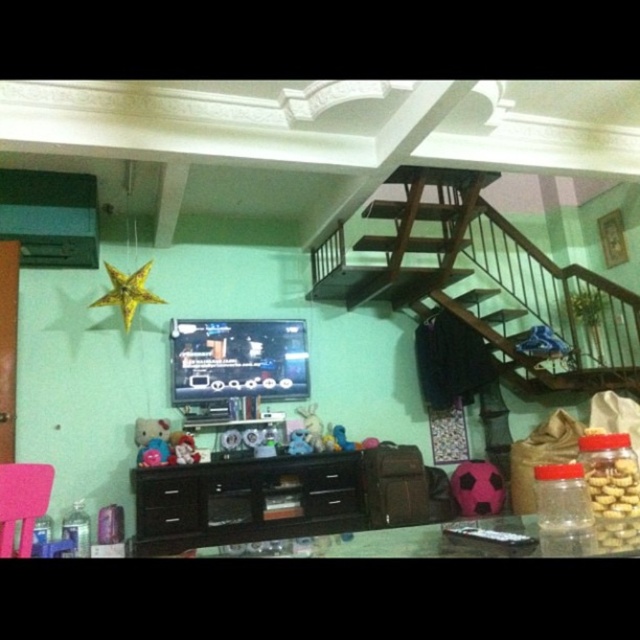
Question: Can you confirm if wooden stairs at upper center is thinner than pink fabric chair at lower left?

Choices:
 (A) yes
 (B) no

Answer: (B)

Question: Which of the following is the farthest from the observer?

Choices:
 (A) plush pink teddy bear at center
 (B) black glossy entertainment center at center
 (C) wooden stairs at upper center

Answer: (A)

Question: Among these points, which one is farthest from the camera?

Choices:
 (A) (168, 515)
 (B) (49, 488)
 (C) (193, 440)

Answer: (C)

Question: Does black glossy entertainment center at center appear over plush pink teddy bear at center?

Choices:
 (A) yes
 (B) no

Answer: (B)

Question: Can you confirm if wooden stairs at upper center is positioned to the left of black glossy entertainment center at center?

Choices:
 (A) no
 (B) yes

Answer: (A)

Question: Among these points, which one is nearest to the camera?

Choices:
 (A) (182, 433)
 (B) (342, 480)

Answer: (B)